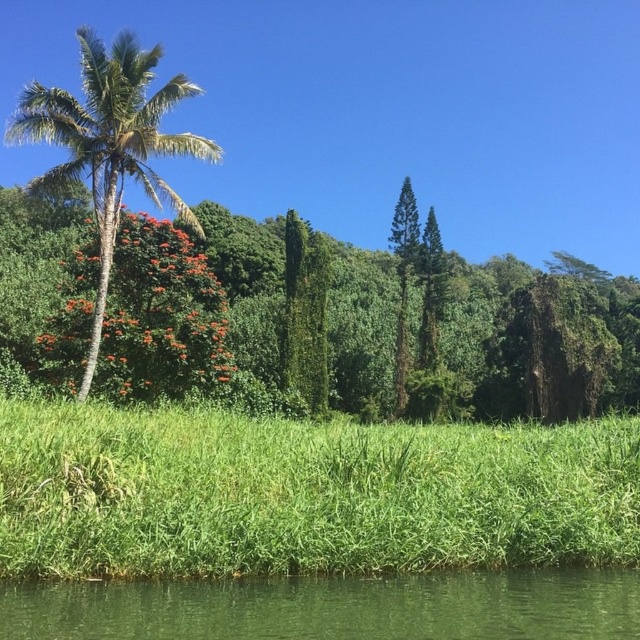
You are standing at the edge of the water in the tropical landscape. You see the green leafy grass at lower center and the green leafy palm tree at left. Which of these two objects takes up more space in the scene?

The green leafy palm tree at left takes up more space in the scene than the green leafy grass at lower center.

You are standing at the edge of the green smooth water at lower center and want to reach the green leafy palm tree at left. Which direction should you face to walk towards it?

The green leafy palm tree at left is located to your left side relative to the green smooth water at lower center, so you should face towards the left direction to walk towards it.

In the tropical landscape, you see a green leafy tree at left and green leafy grass at lower center. Which object is positioned more to the right side of the scene?

The green leafy tree at left is positioned more to the right than the green leafy grass at lower center.